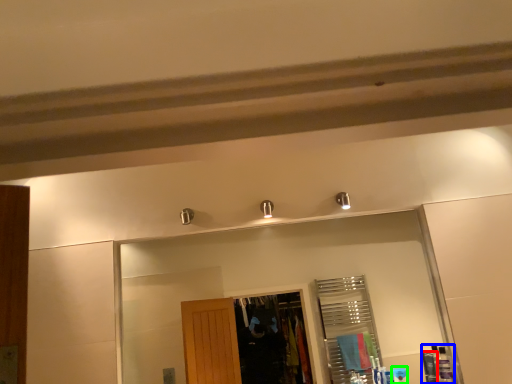
Question: Which object is positioned closest to toiletry (highlighted by a red box)? Select from toiletry (highlighted by a blue box) and toiletry (highlighted by a green box).

Choices:
 (A) toiletry
 (B) toiletry

Answer: (A)